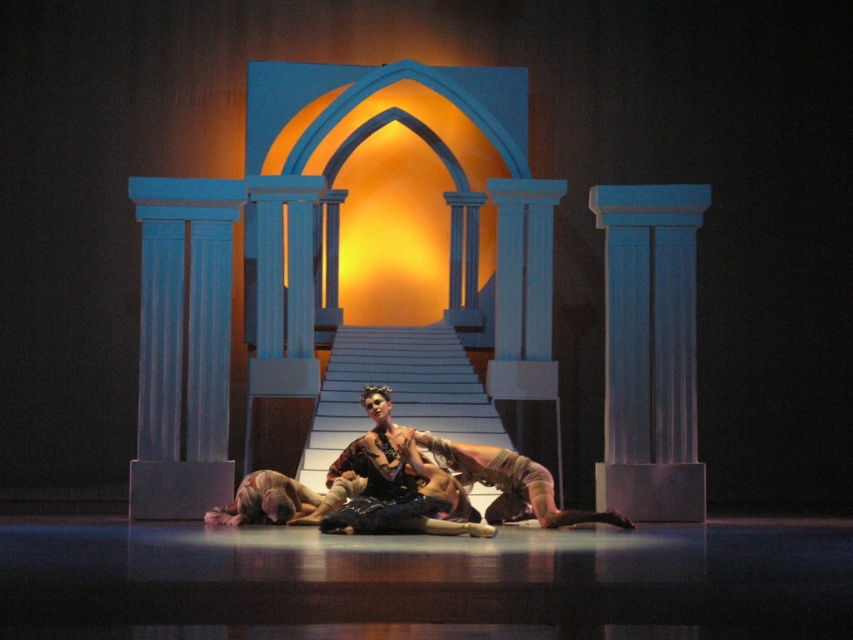
Question: Does shiny black dress at center appear over tan leather pants at center?

Choices:
 (A) no
 (B) yes

Answer: (B)

Question: Does shiny black dress at center have a larger size compared to tan leather pants at center?

Choices:
 (A) no
 (B) yes

Answer: (B)

Question: Among these points, which one is nearest to the camera?

Choices:
 (A) (527, 499)
 (B) (425, 460)

Answer: (B)

Question: Which point is closer to the camera?

Choices:
 (A) (526, 486)
 (B) (383, 387)

Answer: (A)

Question: Which point is farther to the camera?

Choices:
 (A) (503, 488)
 (B) (389, 396)

Answer: (B)

Question: Does shiny black dress at center have a lesser width compared to tan leather pants at center?

Choices:
 (A) no
 (B) yes

Answer: (B)